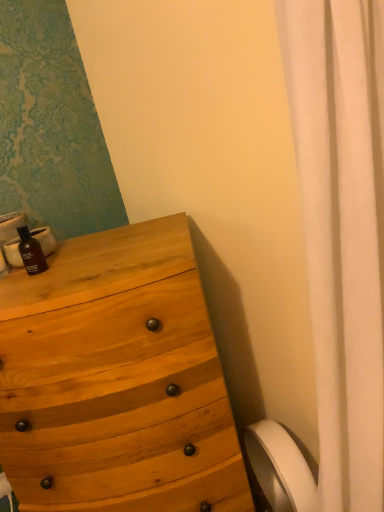
Question: From a real-world perspective, is natural wood chest of drawers at left over matte black bottle at left?

Choices:
 (A) no
 (B) yes

Answer: (A)

Question: Considering the relative sizes of natural wood chest of drawers at left and matte black bottle at left in the image provided, is natural wood chest of drawers at left thinner than matte black bottle at left?

Choices:
 (A) no
 (B) yes

Answer: (A)

Question: Is natural wood chest of drawers at left located outside matte black bottle at left?

Choices:
 (A) yes
 (B) no

Answer: (A)

Question: Considering the relative sizes of natural wood chest of drawers at left and matte black bottle at left in the image provided, is natural wood chest of drawers at left taller than matte black bottle at left?

Choices:
 (A) no
 (B) yes

Answer: (B)

Question: Considering the relative sizes of natural wood chest of drawers at left and matte black bottle at left in the image provided, is natural wood chest of drawers at left wider than matte black bottle at left?

Choices:
 (A) no
 (B) yes

Answer: (B)

Question: Does natural wood chest of drawers at left appear on the left side of matte black bottle at left?

Choices:
 (A) yes
 (B) no

Answer: (B)

Question: From the image's perspective, is matte black bottle at left over natural wood chest of drawers at left?

Choices:
 (A) yes
 (B) no

Answer: (A)

Question: Considering the relative positions of matte black bottle at left and natural wood chest of drawers at left in the image provided, is matte black bottle at left to the left of natural wood chest of drawers at left from the viewer's perspective?

Choices:
 (A) no
 (B) yes

Answer: (B)

Question: Does matte black bottle at left have a lesser width compared to natural wood chest of drawers at left?

Choices:
 (A) no
 (B) yes

Answer: (B)

Question: Is matte black bottle at left facing away from natural wood chest of drawers at left?

Choices:
 (A) yes
 (B) no

Answer: (B)

Question: Does matte black bottle at left have a greater height compared to natural wood chest of drawers at left?

Choices:
 (A) yes
 (B) no

Answer: (B)

Question: Can we say matte black bottle at left lies outside natural wood chest of drawers at left?

Choices:
 (A) no
 (B) yes

Answer: (B)

Question: From the image's perspective, is matte black bottle at left located beneath white matte toilet paper at lower right?

Choices:
 (A) no
 (B) yes

Answer: (A)